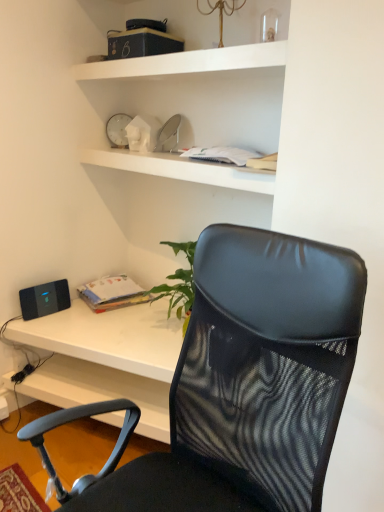
At what (x,y) coordinates should I click in order to perform the action: click on vacant area that lies between black matte speaker at lower left and matte paper book at center. Please return your answer as a coordinate pair (x, y). Looking at the image, I should click on (57, 313).